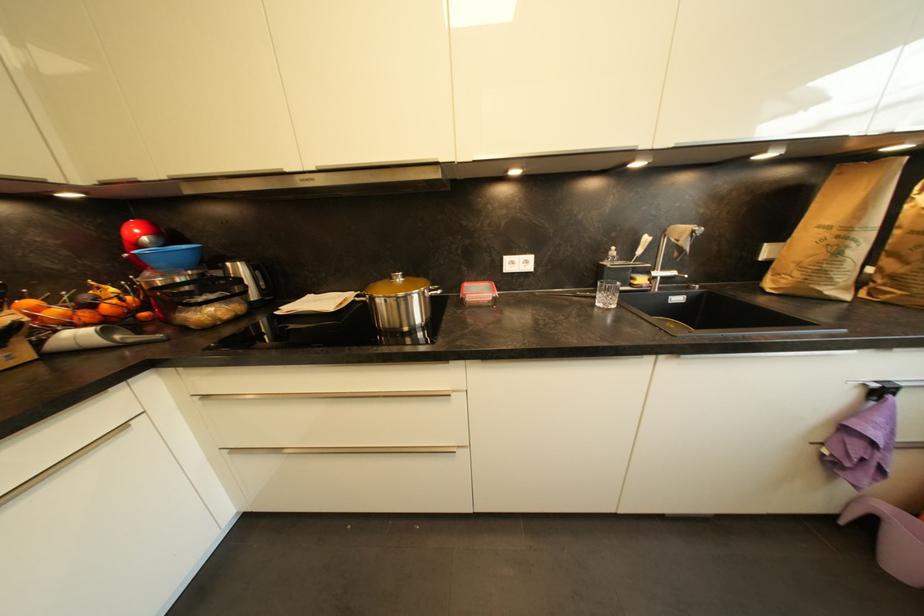
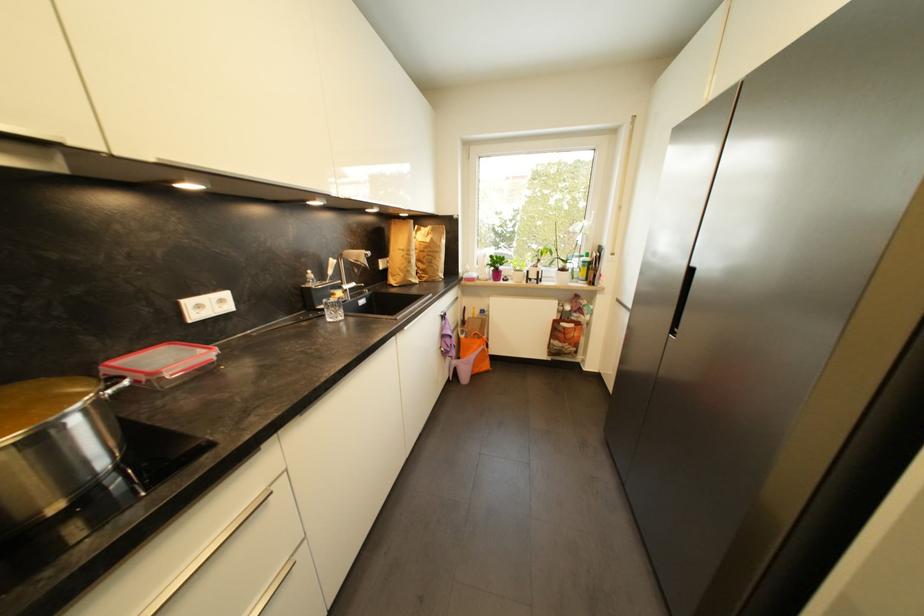
Find the pixel in the second image that matches (x=843, y=254) in the first image.

(415, 264)